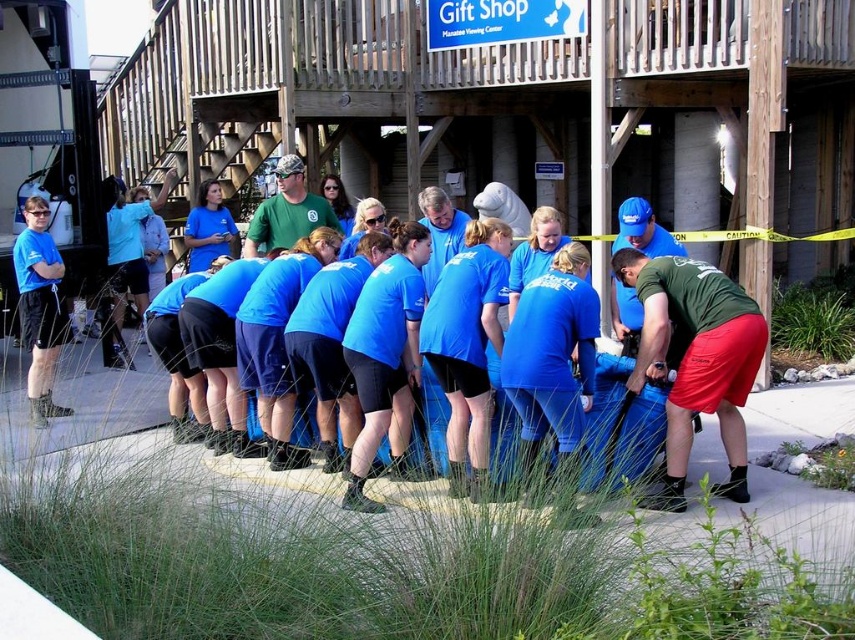
Does green matte shirt at center appear on the left side of matte blue t-shirt at left?

No, green matte shirt at center is not to the left of matte blue t-shirt at left.

This screenshot has height=640, width=855. Find the location of `green matte shirt at center`. green matte shirt at center is located at coordinates (696, 358).

Which is in front, point (679, 333) or point (27, 346)?

Positioned in front is point (679, 333).

Find the location of a particular element. Image resolution: width=855 pixels, height=640 pixels. green matte shirt at center is located at coordinates (696, 358).